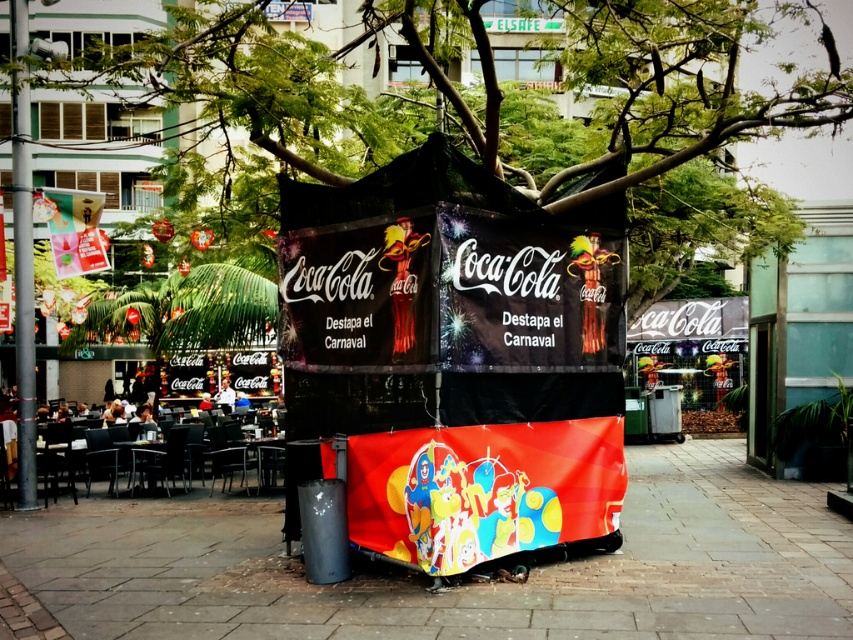
You are standing in the plaza and see the Coca Cola booth. You need to walk from the black metal pole at left to the brick pavement at center. Which direction should you move?

You should move to the right because the brick pavement at center is to the right of the black metal pole at left.

You are a city planner assessing the space in the plaza. The brick pavement at center and the black metal pole at left are both in your path. Which one has a greater width?

The brick pavement at center has a greater width than the black metal pole at left.